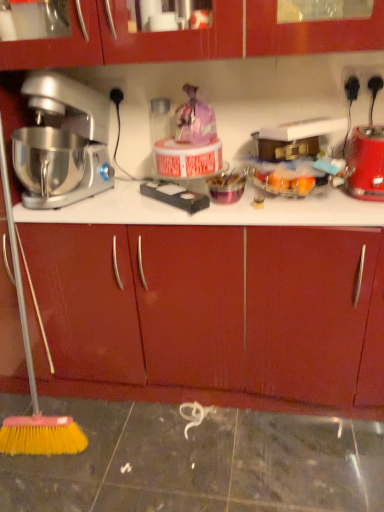
Question: Can you confirm if red plastic blender at right is positioned to the right of silver metallic mixer at left?

Choices:
 (A) no
 (B) yes

Answer: (B)

Question: From a real-world perspective, is red plastic blender at right positioned over silver metallic mixer at left based on gravity?

Choices:
 (A) yes
 (B) no

Answer: (B)

Question: Would you consider red plastic blender at right to be distant from silver metallic mixer at left?

Choices:
 (A) yes
 (B) no

Answer: (B)

Question: Is red plastic blender at right outside of silver metallic mixer at left?

Choices:
 (A) no
 (B) yes

Answer: (B)

Question: From a real-world perspective, does red plastic blender at right sit lower than silver metallic mixer at left?

Choices:
 (A) no
 (B) yes

Answer: (B)

Question: Is red plastic blender at right bigger than silver metallic mixer at left?

Choices:
 (A) yes
 (B) no

Answer: (B)

Question: Is matte wood drawer at center beside silver metallic mixer at left?

Choices:
 (A) no
 (B) yes

Answer: (A)

Question: Considering the relative positions of matte wood drawer at center and silver metallic mixer at left in the image provided, is matte wood drawer at center to the left of silver metallic mixer at left from the viewer's perspective?

Choices:
 (A) yes
 (B) no

Answer: (B)

Question: Is matte wood drawer at center oriented towards silver metallic mixer at left?

Choices:
 (A) no
 (B) yes

Answer: (A)

Question: Is matte wood drawer at center positioned before silver metallic mixer at left?

Choices:
 (A) yes
 (B) no

Answer: (B)

Question: Does matte wood drawer at center have a greater width compared to silver metallic mixer at left?

Choices:
 (A) yes
 (B) no

Answer: (B)

Question: Is matte wood drawer at center further to camera compared to silver metallic mixer at left?

Choices:
 (A) yes
 (B) no

Answer: (A)

Question: Is there a large distance between red plastic blender at right and matte wood drawer at center?

Choices:
 (A) yes
 (B) no

Answer: (B)